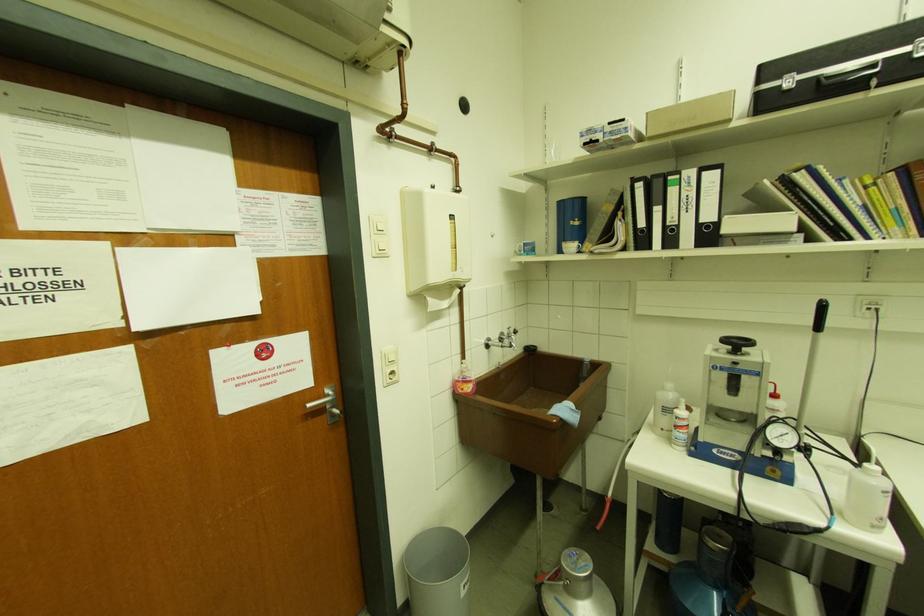
Locate an element on the screen. black ring binder is located at coordinates (709, 205).